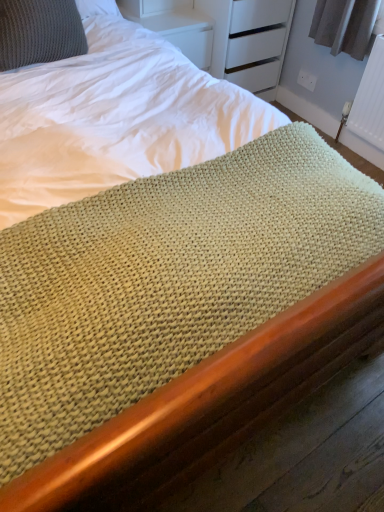
Where is `knitted gray pillow at upper left`? The height and width of the screenshot is (512, 384). knitted gray pillow at upper left is located at coordinates (39, 32).

Image resolution: width=384 pixels, height=512 pixels. Describe the element at coordinates (39, 32) in the screenshot. I see `knitted gray pillow at upper left` at that location.

What do you see at coordinates (370, 99) in the screenshot? The image size is (384, 512). I see `white textured radiator at upper right` at bounding box center [370, 99].

The image size is (384, 512). I want to click on white textured radiator at upper right, so click(370, 99).

Locate an element on the screen. This screenshot has width=384, height=512. knitted gray pillow at upper left is located at coordinates (39, 32).

Is knitted gray pillow at upper left to the right of white textured radiator at upper right from the viewer's perspective?

No, knitted gray pillow at upper left is not to the right of white textured radiator at upper right.

Between knitted gray pillow at upper left and white textured radiator at upper right, which one is positioned in front?

knitted gray pillow at upper left is more forward.

Which is in front, point (20, 32) or point (357, 122)?

The point (20, 32) is more forward.

From the image's perspective, between knitted gray pillow at upper left and white textured radiator at upper right, which one is located above?

Answer: knitted gray pillow at upper left is shown above in the image.

From a real-world perspective, which is physically below, knitted gray pillow at upper left or white textured radiator at upper right?

white textured radiator at upper right, from a real-world perspective.

Which of these two, knitted gray pillow at upper left or white textured radiator at upper right, is thinner?

white textured radiator at upper right.

From the picture: In terms of height, does knitted gray pillow at upper left look taller or shorter compared to white textured radiator at upper right?

Clearly, knitted gray pillow at upper left is shorter compared to white textured radiator at upper right.

Does knitted gray pillow at upper left have a larger size compared to white textured radiator at upper right?

Yes, knitted gray pillow at upper left is bigger than white textured radiator at upper right.

Is knitted gray pillow at upper left spatially inside white textured radiator at upper right, or outside of it?

knitted gray pillow at upper left is outside white textured radiator at upper right.

Is knitted gray pillow at upper left far from white textured radiator at upper right?

Indeed, knitted gray pillow at upper left is not near white textured radiator at upper right.

Is knitted gray pillow at upper left facing towards white textured radiator at upper right?

No, knitted gray pillow at upper left is not facing towards white textured radiator at upper right.

How different are the orientations of knitted gray pillow at upper left and white textured radiator at upper right in degrees?

There is a 97.2-degree angle between the facing directions of knitted gray pillow at upper left and white textured radiator at upper right.

How far apart are knitted gray pillow at upper left and white textured radiator at upper right?

The distance of knitted gray pillow at upper left from white textured radiator at upper right is 5.16 feet.

The width and height of the screenshot is (384, 512). What are the coordinates of `radiator that is on the right side of knitted gray pillow at upper left` in the screenshot? It's located at (370, 99).

Based on their positions, is white textured radiator at upper right located to the left or right of knitted gray pillow at upper left?

From the image, it's evident that white textured radiator at upper right is to the right of knitted gray pillow at upper left.

Considering the positions of objects white textured radiator at upper right and knitted gray pillow at upper left in the image provided, who is in front, white textured radiator at upper right or knitted gray pillow at upper left?

knitted gray pillow at upper left.

Which point is more forward, (368, 117) or (59, 25)?

The point (59, 25) is closer.

From the image's perspective, between white textured radiator at upper right and knitted gray pillow at upper left, which one is located above?

knitted gray pillow at upper left.

From a real-world perspective, who is located higher, white textured radiator at upper right or knitted gray pillow at upper left?

knitted gray pillow at upper left is physically above.

Can you confirm if white textured radiator at upper right is wider than knitted gray pillow at upper left?

Incorrect, the width of white textured radiator at upper right does not surpass that of knitted gray pillow at upper left.

From their relative heights in the image, would you say white textured radiator at upper right is taller or shorter than knitted gray pillow at upper left?

Clearly, white textured radiator at upper right is taller compared to knitted gray pillow at upper left.

Between white textured radiator at upper right and knitted gray pillow at upper left, which one has smaller size?

Smaller between the two is white textured radiator at upper right.

Choose the correct answer: Is white textured radiator at upper right inside knitted gray pillow at upper left or outside it?

white textured radiator at upper right is not enclosed by knitted gray pillow at upper left.

Is white textured radiator at upper right far from knitted gray pillow at upper left?

Yes, white textured radiator at upper right is far from knitted gray pillow at upper left.

Is white textured radiator at upper right oriented towards knitted gray pillow at upper left?

No, white textured radiator at upper right is not turned towards knitted gray pillow at upper left.

Locate an element on the screen. Image resolution: width=384 pixels, height=512 pixels. pillow located above the white textured radiator at upper right (from a real-world perspective) is located at coordinates (39, 32).

You are a GUI agent. You are given a task and a screenshot of the screen. Output one action in this format:
    pyautogui.click(x=<x>, y=<y>)
    Task: Click on the pillow in front of the white textured radiator at upper right
    
    Given the screenshot: What is the action you would take?
    pyautogui.click(x=39, y=32)

Identify the location of pillow located above the white textured radiator at upper right (from the image's perspective). The width and height of the screenshot is (384, 512). (39, 32).